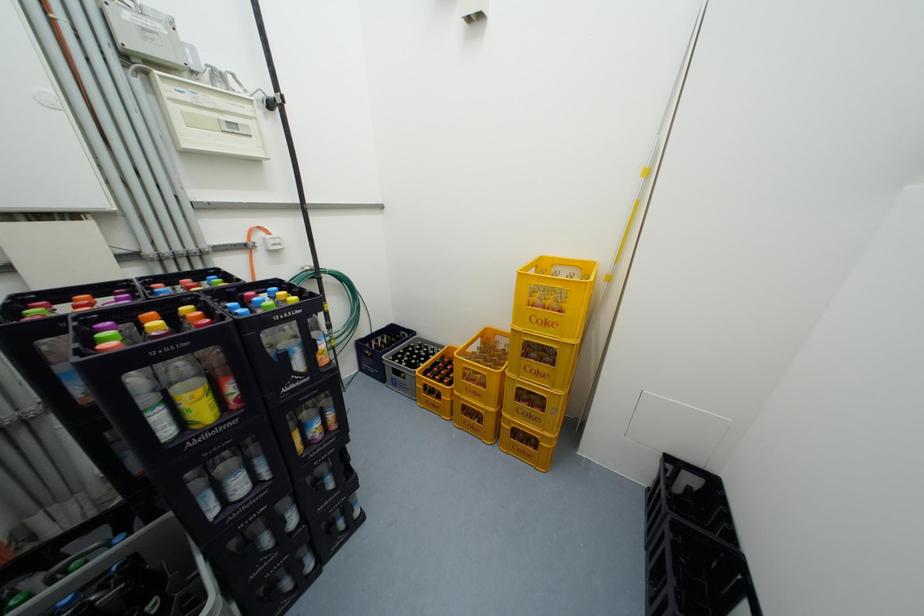
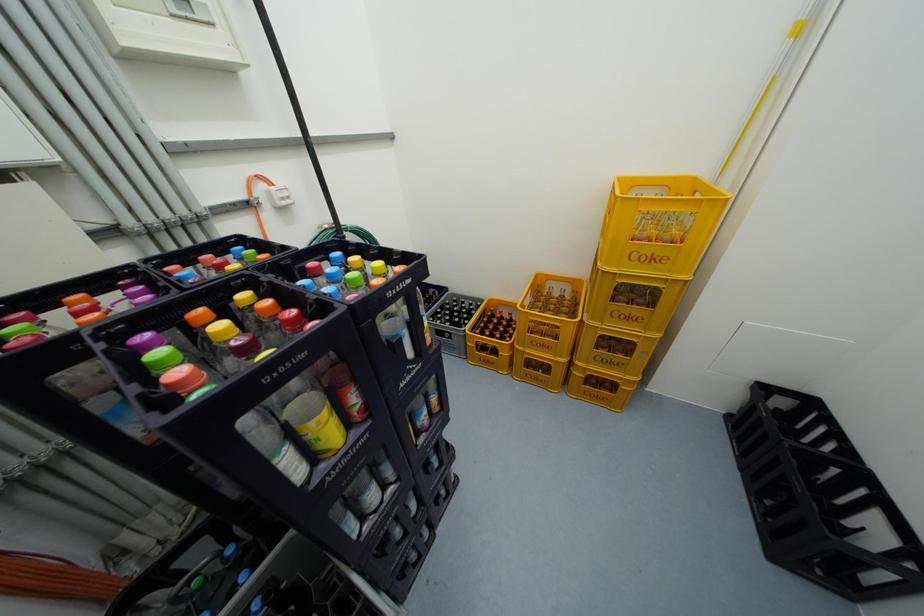
Which direction would the cameraman need to move to produce the second image?

The cameraman moved toward left, forward.